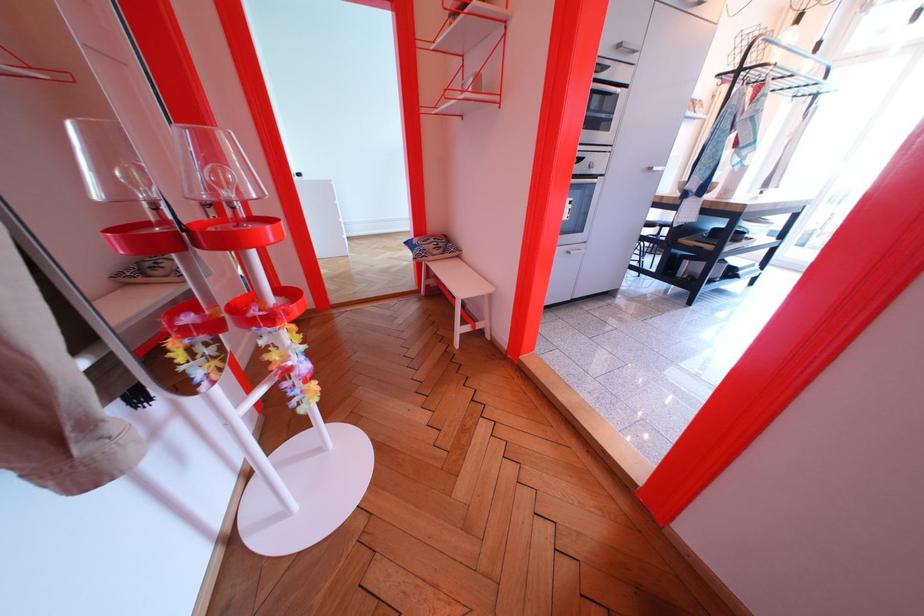
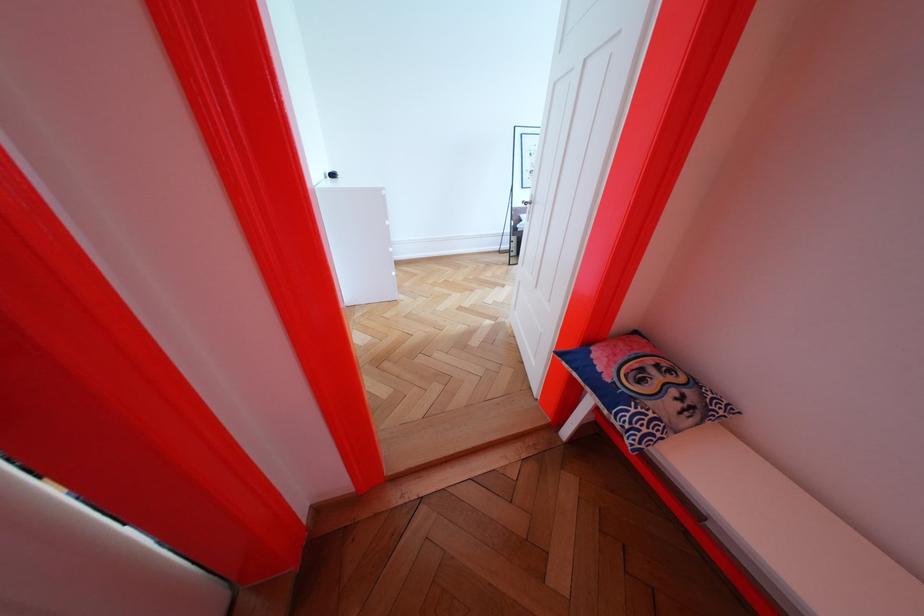
What movement of the cameraman would produce the second image?

The cameraman moved toward left, forward.